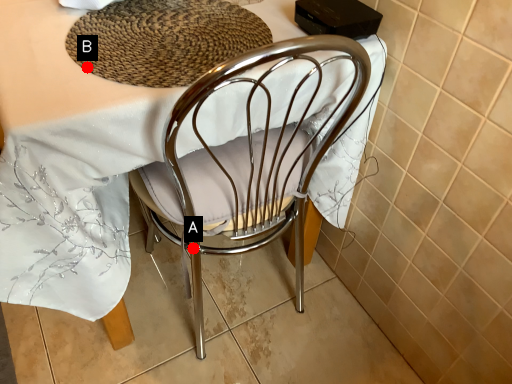
Question: Two points are circled on the image, labeled by A and B beside each circle. Among these points, which one is nearest to the camera?

Choices:
 (A) A is closer
 (B) B is closer

Answer: (B)